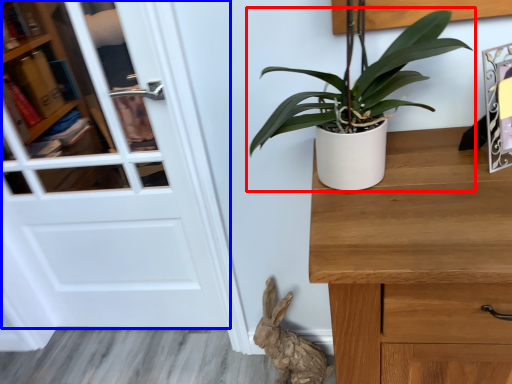
Question: Which object appears farthest to the camera in this image, houseplant (highlighted by a red box) or door (highlighted by a blue box)?

Choices:
 (A) houseplant
 (B) door

Answer: (B)